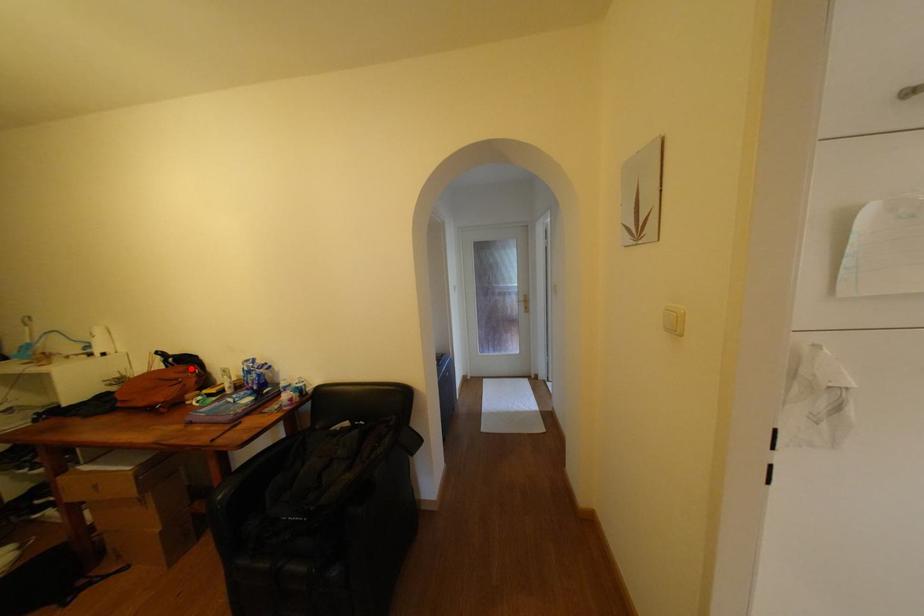
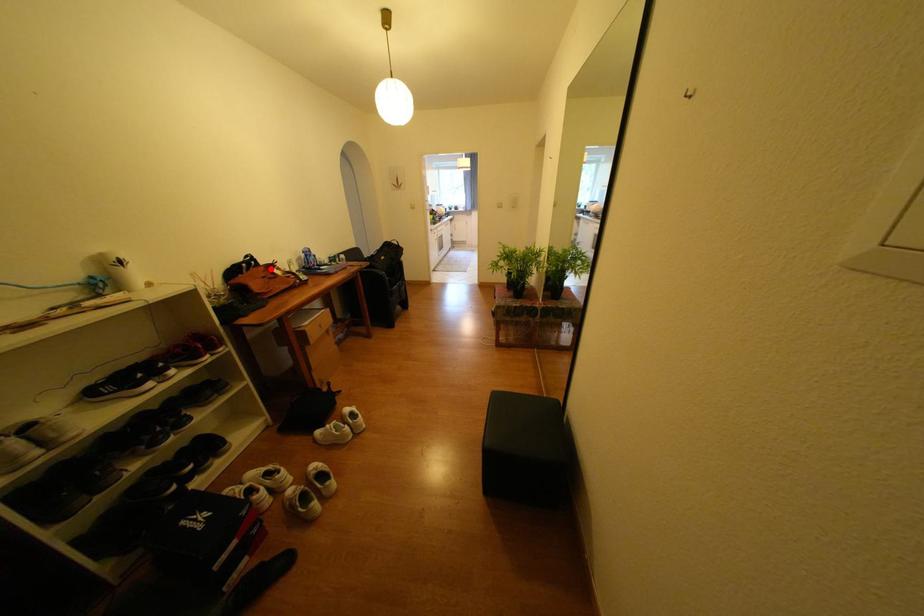
I am providing you with two images of the same scene from different viewpoints. A red point is marked on the first image and another point is marked on the second image. Is the marked point in image1 the same physical position as the marked point in image2?

Yes